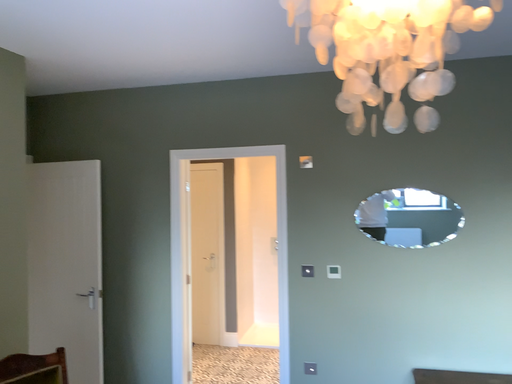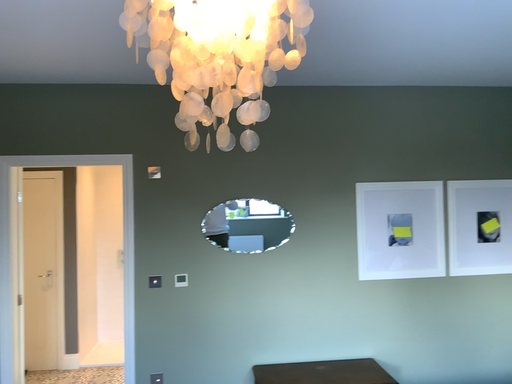
Question: How did the camera likely rotate when shooting the video?

Choices:
 (A) rotated left
 (B) rotated right

Answer: (B)